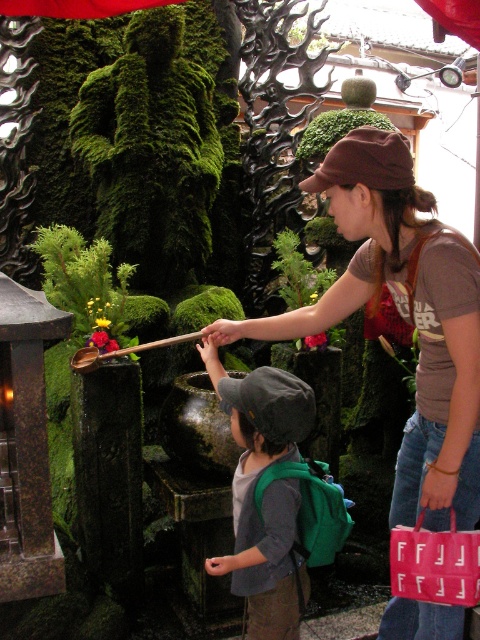
Question: Does brown fabric shirt at center appear under gray fabric cap at center?

Choices:
 (A) no
 (B) yes

Answer: (A)

Question: Based on their relative distances, which object is nearer to the brown fabric shirt at center?

Choices:
 (A) brown fabric baseball cap at center
 (B) gray fabric cap at center

Answer: (A)

Question: Considering the real-world distances, which object is closest to the gray fabric cap at center?

Choices:
 (A) brown fabric shirt at center
 (B) brown fabric baseball cap at center

Answer: (A)

Question: Which of these objects is positioned closest to the brown fabric shirt at center?

Choices:
 (A) gray fabric cap at center
 (B) brown fabric baseball cap at center

Answer: (B)

Question: Is brown fabric shirt at center thinner than gray fabric cap at center?

Choices:
 (A) no
 (B) yes

Answer: (A)

Question: Does brown fabric shirt at center appear over gray fabric cap at center?

Choices:
 (A) yes
 (B) no

Answer: (A)